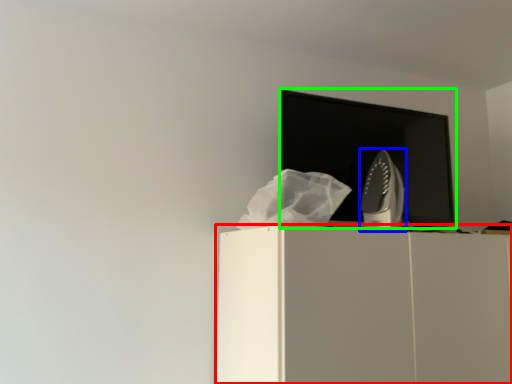
Question: Which object is the farthest from furniture (highlighted by a red box)? Choose among these: home appliance (highlighted by a blue box) or computer monitor (highlighted by a green box).

Choices:
 (A) home appliance
 (B) computer monitor

Answer: (B)